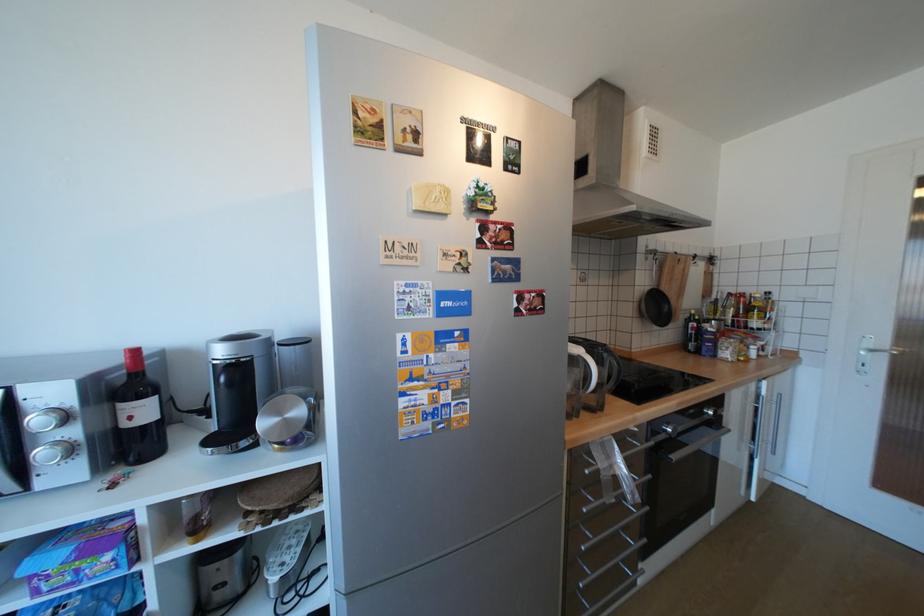
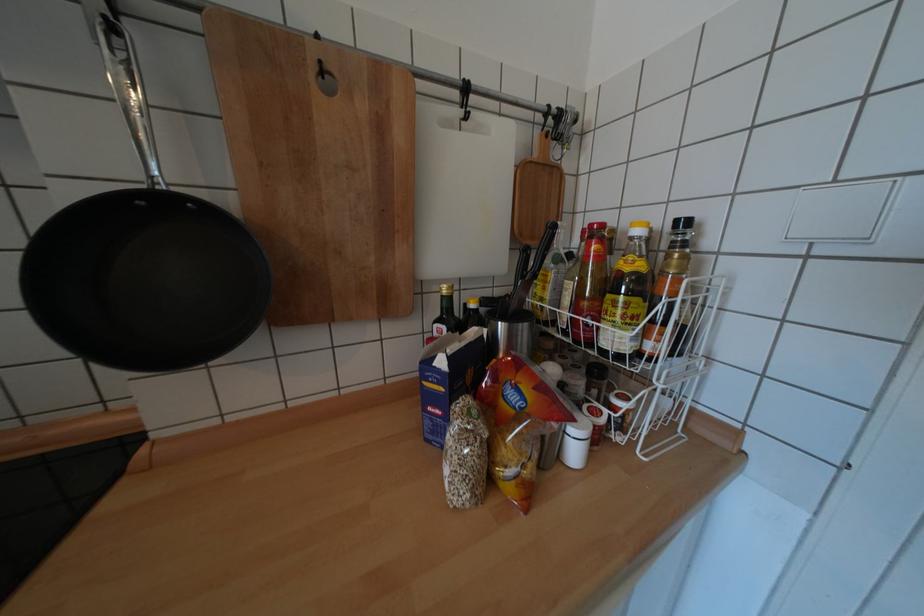
What movement of the cameraman would produce the second image?

The cameraman moved toward right, forward.